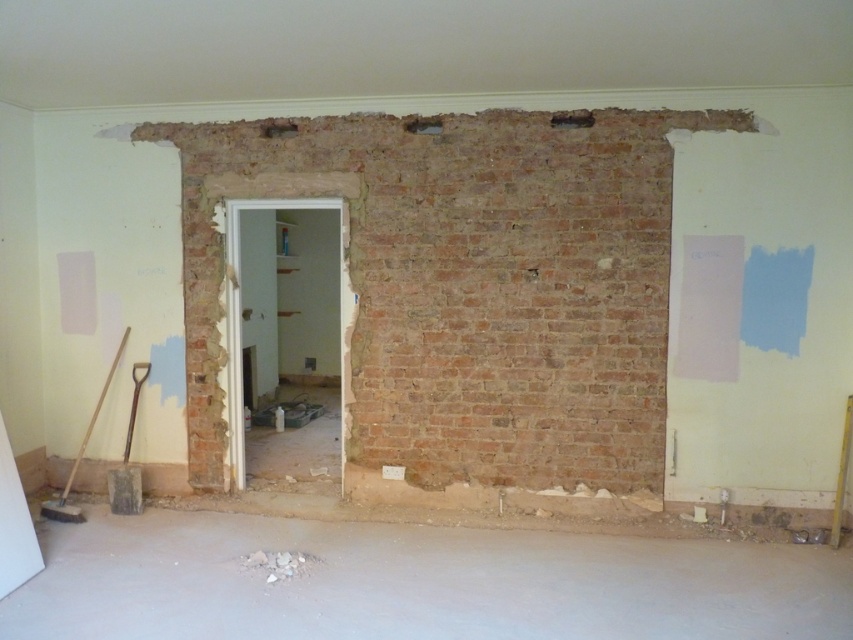
Can you confirm if brick wall hole at upper center is thinner than smooth concrete hole at center?

Incorrect, brick wall hole at upper center's width is not less than smooth concrete hole at center's.

Does point (590, 125) lie in front of point (418, 128)?

That is True.

Where is `brick wall hole at upper center`? The image size is (853, 640). brick wall hole at upper center is located at coordinates (572, 120).

Can you confirm if crumbly concrete debris at lower center is thinner than smooth concrete hole at center?

Incorrect, crumbly concrete debris at lower center's width is not less than smooth concrete hole at center's.

Is crumbly concrete debris at lower center shorter than smooth concrete hole at center?

Yes, crumbly concrete debris at lower center is shorter than smooth concrete hole at center.

Who is more distant from viewer, (258, 557) or (427, 128)?

The point (427, 128) is more distant.

Where is `crumbly concrete debris at lower center`? crumbly concrete debris at lower center is located at coordinates (277, 563).

The height and width of the screenshot is (640, 853). What do you see at coordinates (277, 563) in the screenshot?
I see `crumbly concrete debris at lower center` at bounding box center [277, 563].

This screenshot has width=853, height=640. What are the coordinates of `crumbly concrete debris at lower center` in the screenshot? It's located at (277, 563).